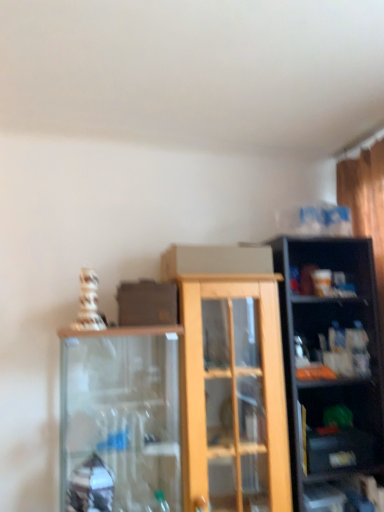
The height and width of the screenshot is (512, 384). What do you see at coordinates (332, 339) in the screenshot? I see `clear plastic bottles at right, which is counted as the second shelf, starting from the bottom` at bounding box center [332, 339].

Find the location of `clear plastic bottles at right, which is counted as the second shelf, starting from the bottom`. clear plastic bottles at right, which is counted as the second shelf, starting from the bottom is located at coordinates (332, 339).

The width and height of the screenshot is (384, 512). I want to click on matte black shelf at lower right, which is the 1th shelf in bottom-to-top order, so click(340, 426).

In the scene shown: What is the approximate width of matte black shelf at lower right, which is the 1th shelf in bottom-to-top order?

matte black shelf at lower right, which is the 1th shelf in bottom-to-top order, is 7.31 inches wide.

Describe the element at coordinates (340, 426) in the screenshot. The image size is (384, 512). I see `matte black shelf at lower right, which is the 1th shelf in bottom-to-top order` at that location.

Identify the location of clear plastic bottles at right, placed as the 1th shelf when sorted from top to bottom. The image size is (384, 512). (332, 339).

In the image, is clear plastic bottles at right, placed as the 1th shelf when sorted from top to bottom, on the left side or the right side of matte black shelf at lower right, which is the 1th shelf in bottom-to-top order?

clear plastic bottles at right, placed as the 1th shelf when sorted from top to bottom, is positioned on matte black shelf at lower right, which is the 1th shelf in bottom-to-top order,'s right side.

Who is more distant, clear plastic bottles at right, placed as the 1th shelf when sorted from top to bottom, or matte black shelf at lower right, which is the 1th shelf in bottom-to-top order?

clear plastic bottles at right, placed as the 1th shelf when sorted from top to bottom.

Considering the points (333, 368) and (353, 418), which point is behind, point (333, 368) or point (353, 418)?

The point (353, 418) is more distant.

From the picture: From the image's perspective, is clear plastic bottles at right, placed as the 1th shelf when sorted from top to bottom, located beneath matte black shelf at lower right, which is the 1th shelf in bottom-to-top order?

Actually, clear plastic bottles at right, placed as the 1th shelf when sorted from top to bottom, appears above matte black shelf at lower right, which is the 1th shelf in bottom-to-top order, in the image.

From a real-world perspective, is clear plastic bottles at right, placed as the 1th shelf when sorted from top to bottom, above or below matte black shelf at lower right, which is the 1th shelf in bottom-to-top order?

clear plastic bottles at right, placed as the 1th shelf when sorted from top to bottom, is above matte black shelf at lower right, which is the 1th shelf in bottom-to-top order.

Considering the relative sizes of clear plastic bottles at right, which is counted as the second shelf, starting from the bottom, and matte black shelf at lower right, which is the 1th shelf in bottom-to-top order, in the image provided, is clear plastic bottles at right, which is counted as the second shelf, starting from the bottom, wider than matte black shelf at lower right, which is the 1th shelf in bottom-to-top order,?

Yes, clear plastic bottles at right, which is counted as the second shelf, starting from the bottom, is wider than matte black shelf at lower right, which is the 1th shelf in bottom-to-top order.

Does clear plastic bottles at right, placed as the 1th shelf when sorted from top to bottom, have a lesser height compared to matte black shelf at lower right, the 2th shelf viewed from the top?

No.

Consider the image. In terms of size, does clear plastic bottles at right, which is counted as the second shelf, starting from the bottom, appear bigger or smaller than matte black shelf at lower right, which is the 1th shelf in bottom-to-top order?

Clearly, clear plastic bottles at right, which is counted as the second shelf, starting from the bottom, is larger in size than matte black shelf at lower right, which is the 1th shelf in bottom-to-top order.

Could matte black shelf at lower right, which is the 1th shelf in bottom-to-top order, be considered to be inside clear plastic bottles at right, which is counted as the second shelf, starting from the bottom?

No, clear plastic bottles at right, which is counted as the second shelf, starting from the bottom, does not contain matte black shelf at lower right, which is the 1th shelf in bottom-to-top order.

Is clear plastic bottles at right, which is counted as the second shelf, starting from the bottom, with matte black shelf at lower right, the 2th shelf viewed from the top?

clear plastic bottles at right, which is counted as the second shelf, starting from the bottom, is not next to matte black shelf at lower right, the 2th shelf viewed from the top, and they're not touching.

Is clear plastic bottles at right, placed as the 1th shelf when sorted from top to bottom, positioned with its back to matte black shelf at lower right, the 2th shelf viewed from the top?

No, clear plastic bottles at right, placed as the 1th shelf when sorted from top to bottom, is not facing away from matte black shelf at lower right, the 2th shelf viewed from the top.

Can you tell me how much clear plastic bottles at right, which is counted as the second shelf, starting from the bottom, and matte black shelf at lower right, which is the 1th shelf in bottom-to-top order, differ in facing direction?

0.15 degrees separate the facing orientations of clear plastic bottles at right, which is counted as the second shelf, starting from the bottom, and matte black shelf at lower right, which is the 1th shelf in bottom-to-top order.

Could you measure the distance between clear plastic bottles at right, placed as the 1th shelf when sorted from top to bottom, and matte black shelf at lower right, which is the 1th shelf in bottom-to-top order?

They are 7.97 inches apart.

Identify the location of shelf above the matte black shelf at lower right, the 2th shelf viewed from the top (from the image's perspective). (332, 339).

Can you confirm if matte black shelf at lower right, which is the 1th shelf in bottom-to-top order, is positioned to the right of clear plastic bottles at right, placed as the 1th shelf when sorted from top to bottom?

No.

Is the depth of matte black shelf at lower right, the 2th shelf viewed from the top, less than that of clear plastic bottles at right, which is counted as the second shelf, starting from the bottom?

Yes, the depth of matte black shelf at lower right, the 2th shelf viewed from the top, is less than that of clear plastic bottles at right, which is counted as the second shelf, starting from the bottom.

Between point (322, 447) and point (321, 298), which one is positioned behind?

The point (321, 298) is more distant.

From the image's perspective, is matte black shelf at lower right, the 2th shelf viewed from the top, positioned above or below clear plastic bottles at right, which is counted as the second shelf, starting from the bottom?

matte black shelf at lower right, the 2th shelf viewed from the top, is situated lower than clear plastic bottles at right, which is counted as the second shelf, starting from the bottom, in the image.

From a real-world perspective, which is physically below, matte black shelf at lower right, which is the 1th shelf in bottom-to-top order, or clear plastic bottles at right, placed as the 1th shelf when sorted from top to bottom?

matte black shelf at lower right, which is the 1th shelf in bottom-to-top order, is physically lower.

Between matte black shelf at lower right, the 2th shelf viewed from the top, and clear plastic bottles at right, which is counted as the second shelf, starting from the bottom, which one has smaller width?

Thinner between the two is matte black shelf at lower right, the 2th shelf viewed from the top.

Who is shorter, matte black shelf at lower right, which is the 1th shelf in bottom-to-top order, or clear plastic bottles at right, which is counted as the second shelf, starting from the bottom?

Standing shorter between the two is matte black shelf at lower right, which is the 1th shelf in bottom-to-top order.

Is matte black shelf at lower right, the 2th shelf viewed from the top, bigger or smaller than clear plastic bottles at right, which is counted as the second shelf, starting from the bottom?

Considering their sizes, matte black shelf at lower right, the 2th shelf viewed from the top, takes up less space than clear plastic bottles at right, which is counted as the second shelf, starting from the bottom.

Is matte black shelf at lower right, the 2th shelf viewed from the top, spatially inside clear plastic bottles at right, placed as the 1th shelf when sorted from top to bottom, or outside of it?

matte black shelf at lower right, the 2th shelf viewed from the top, is not enclosed by clear plastic bottles at right, placed as the 1th shelf when sorted from top to bottom.

Can you see matte black shelf at lower right, which is the 1th shelf in bottom-to-top order, touching clear plastic bottles at right, placed as the 1th shelf when sorted from top to bottom?

No, matte black shelf at lower right, which is the 1th shelf in bottom-to-top order, is not making contact with clear plastic bottles at right, placed as the 1th shelf when sorted from top to bottom.

Is clear plastic bottles at right, placed as the 1th shelf when sorted from top to bottom, at the back of matte black shelf at lower right, the 2th shelf viewed from the top?

No, matte black shelf at lower right, the 2th shelf viewed from the top, is not facing away from clear plastic bottles at right, placed as the 1th shelf when sorted from top to bottom.

Find the location of a particular element. shelf on the right of matte black shelf at lower right, the 2th shelf viewed from the top is located at coordinates (332, 339).

Where is `shelf that appears above the matte black shelf at lower right, which is the 1th shelf in bottom-to-top order (from the image's perspective)`? This screenshot has width=384, height=512. shelf that appears above the matte black shelf at lower right, which is the 1th shelf in bottom-to-top order (from the image's perspective) is located at coordinates (332, 339).

At what (x,y) coordinates should I click in order to perform the action: click on shelf in front of the clear plastic bottles at right, which is counted as the second shelf, starting from the bottom. Please return your answer as a coordinate pair (x, y). Looking at the image, I should click on (340, 426).